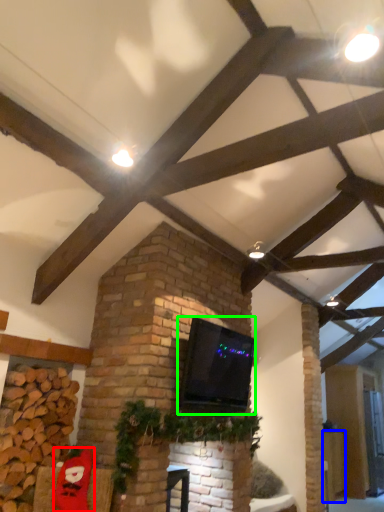
Question: Which object is positioned closest to santa claus (highlighted by a red box)? Select from furniture (highlighted by a blue box) and wide (highlighted by a green box).

Choices:
 (A) furniture
 (B) wide

Answer: (B)